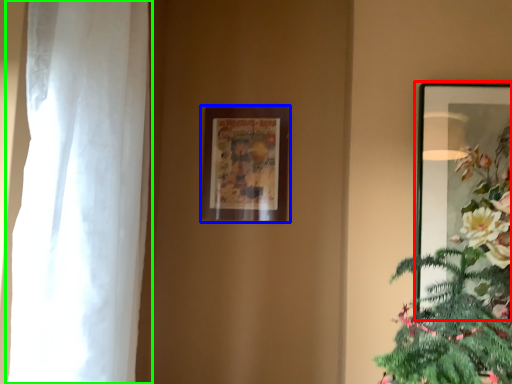
Question: Which is nearer to the picture frame (highlighted by a red box)? picture frame (highlighted by a blue box) or curtain (highlighted by a green box).

Choices:
 (A) picture frame
 (B) curtain

Answer: (A)